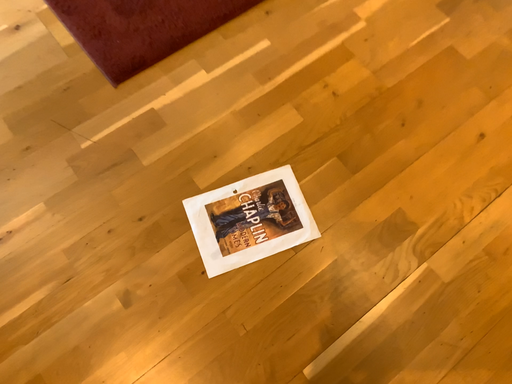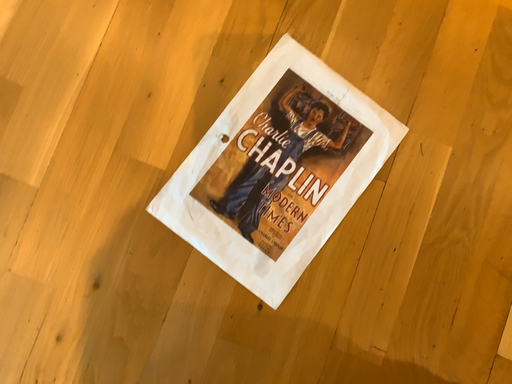
Question: How did the camera likely rotate when shooting the video?

Choices:
 (A) rotated upward
 (B) rotated downward

Answer: (B)